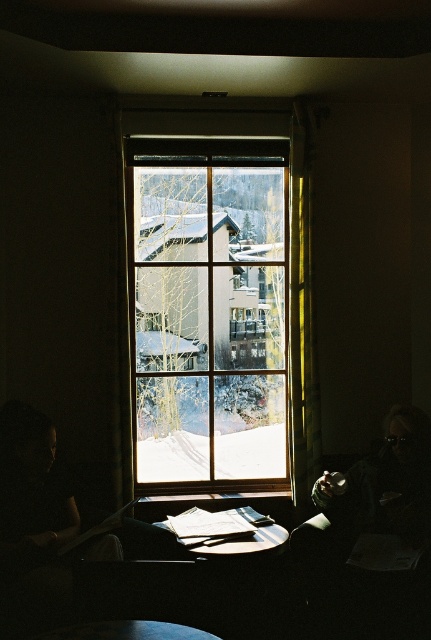
Question: Which of the following is the farthest from the observer?

Choices:
 (A) (305, 392)
 (B) (194, 540)

Answer: (A)

Question: Which object is the farthest from the yellow fabric curtain at right?

Choices:
 (A) clear glass window at center
 (B) wooden table at center

Answer: (B)

Question: Is clear glass window at center smaller than wooden table at center?

Choices:
 (A) yes
 (B) no

Answer: (B)

Question: Among these objects, which one is nearest to the camera?

Choices:
 (A) yellow fabric curtain at right
 (B) wooden table at center

Answer: (B)

Question: Is clear glass window at center positioned in front of wooden table at center?

Choices:
 (A) yes
 (B) no

Answer: (B)

Question: In this image, where is clear glass window at center located relative to yellow fabric curtain at right?

Choices:
 (A) above
 (B) below

Answer: (B)